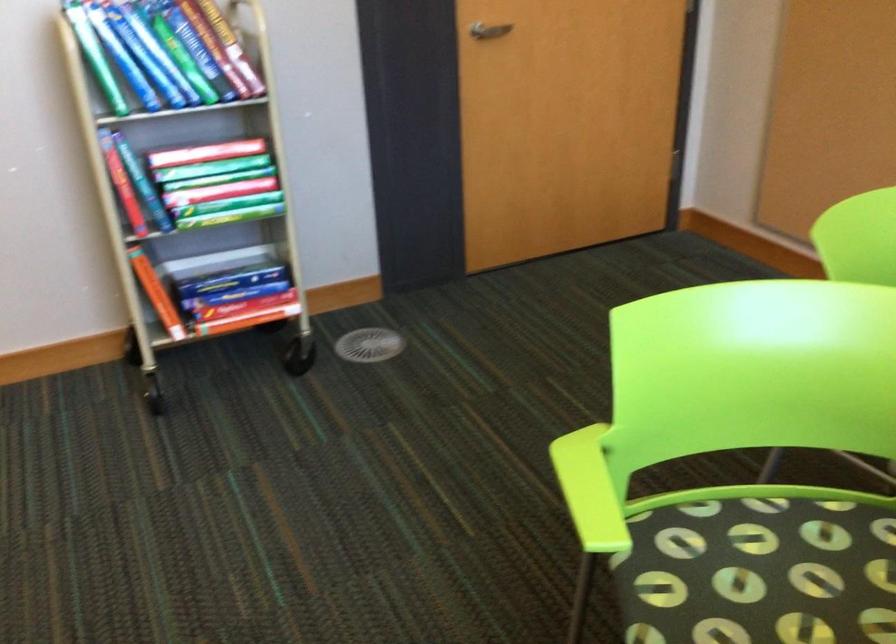
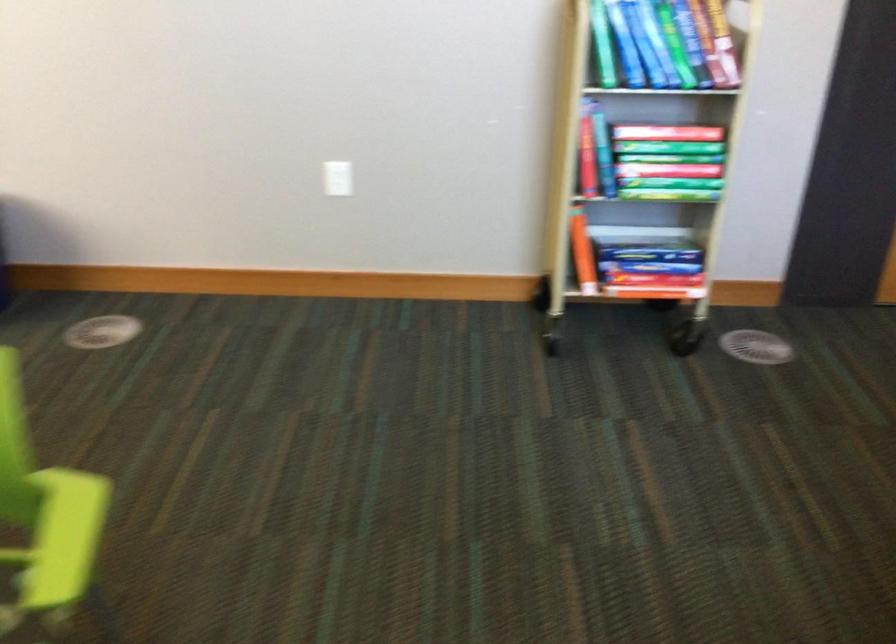
Question: How did the camera likely rotate?

Choices:
 (A) Left
 (B) Right
 (C) Up
 (D) Down

Answer: (A)